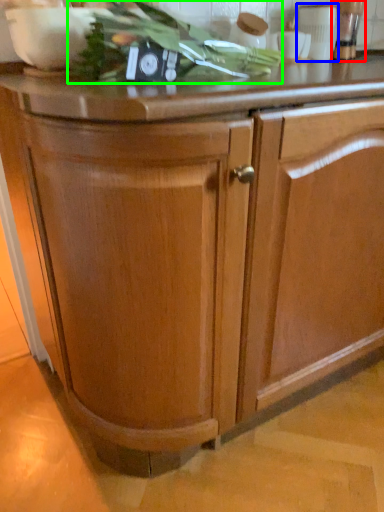
Question: Which object is positioned closest to appliance (highlighted by a red box)? Select from appliance (highlighted by a blue box) and vegetable (highlighted by a green box).

Choices:
 (A) appliance
 (B) vegetable

Answer: (A)